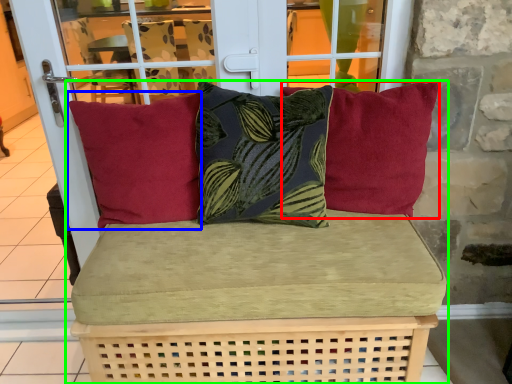
Question: Considering the real-world distances, which object is closest to pillow (highlighted by a red box)? pillow (highlighted by a blue box) or studio couch (highlighted by a green box).

Choices:
 (A) pillow
 (B) studio couch

Answer: (B)